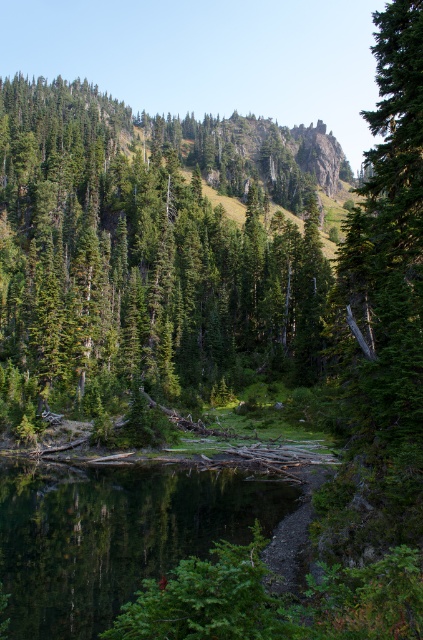
Is green matte tree at center to the right of smooth reflective water at center from the viewer's perspective?

No, green matte tree at center is not to the right of smooth reflective water at center.

Which of these two, green matte tree at center or smooth reflective water at center, stands taller?

green matte tree at center is taller.

In the scene shown: Who is more distant from viewer, (98, 227) or (169, 477)?

Positioned behind is point (98, 227).

The height and width of the screenshot is (640, 423). What are the coordinates of `green matte tree at center` in the screenshot? It's located at point(150,256).